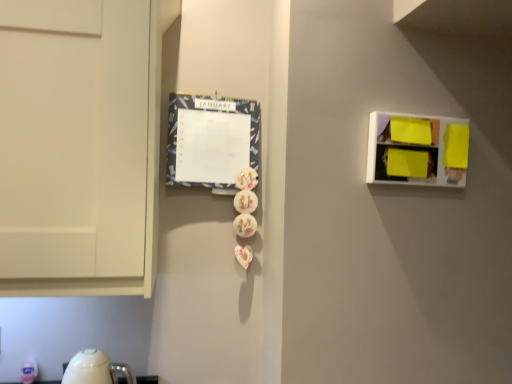
Question: Do you think bright yellow plastic at upper right is within blue fabric calendar at center-left, or outside of it?

Choices:
 (A) outside
 (B) inside

Answer: (A)

Question: Considering their positions, is bright yellow plastic at upper right located in front of or behind blue fabric calendar at center-left?

Choices:
 (A) behind
 (B) front

Answer: (B)

Question: Based on their positions, is bright yellow plastic at upper right located to the left or right of blue fabric calendar at center-left?

Choices:
 (A) left
 (B) right

Answer: (B)

Question: Is point (207, 127) positioned closer to the camera than point (430, 122)?

Choices:
 (A) farther
 (B) closer

Answer: (A)

Question: Relative to bright yellow plastic at upper right, is blue fabric calendar at center-left in front or behind?

Choices:
 (A) front
 (B) behind

Answer: (B)

Question: Considering the positions of blue fabric calendar at center-left and bright yellow plastic at upper right in the image, is blue fabric calendar at center-left bigger or smaller than bright yellow plastic at upper right?

Choices:
 (A) big
 (B) small

Answer: (A)

Question: From a real-world perspective, is blue fabric calendar at center-left physically located above or below bright yellow plastic at upper right?

Choices:
 (A) below
 (B) above

Answer: (B)